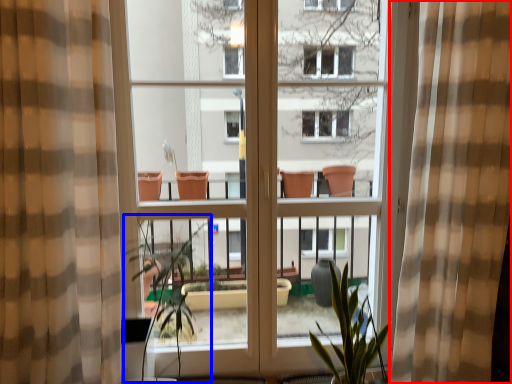
Question: Which of the following is the farthest to the observer, curtain (highlighted by a red box) or vegetation (highlighted by a blue box)?

Choices:
 (A) curtain
 (B) vegetation

Answer: (B)